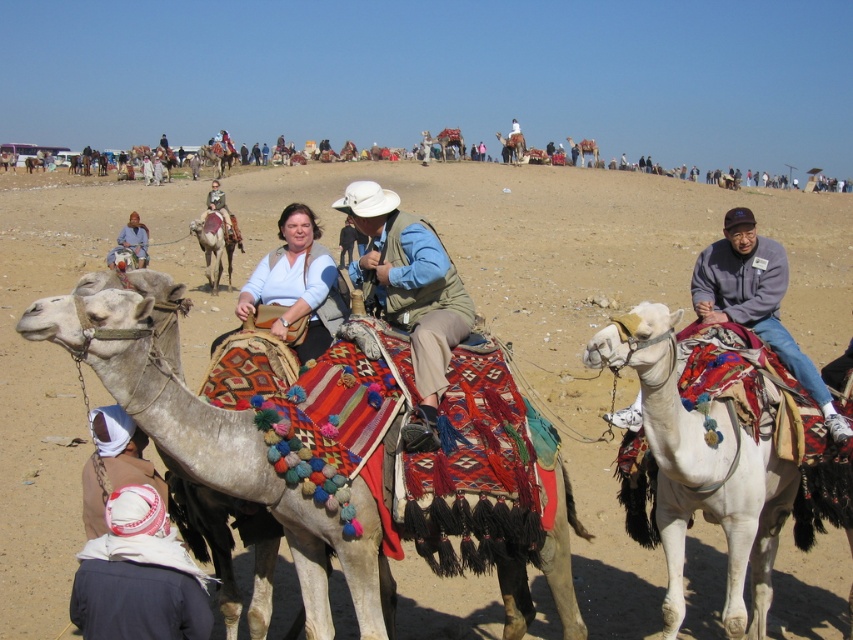
Question: Can you confirm if matte blue shirt at center is wider than light brown leather jacket at center?

Choices:
 (A) yes
 (B) no

Answer: (B)

Question: Which is nearer to the light brown fabric vest at center?

Choices:
 (A) matte white shirt at center
 (B) white soft camel at right
 (C) matte blue shirt at center

Answer: (A)

Question: Considering the relative positions of white textured camel at center and brown textured camel at center in the image provided, where is white textured camel at center located with respect to brown textured camel at center?

Choices:
 (A) right
 (B) left

Answer: (A)

Question: Which object is the closest to the light brown fabric vest at center?

Choices:
 (A) white knitted hat at lower left
 (B) white soft camel at right

Answer: (A)

Question: Does light brown fabric vest at center appear under gray fleece jacket at right?

Choices:
 (A) yes
 (B) no

Answer: (A)

Question: Which of the following is the farthest from the observer?

Choices:
 (A) light brown fabric vest at center
 (B) matte blue shirt at center
 (C) white knitted hat at lower left

Answer: (B)